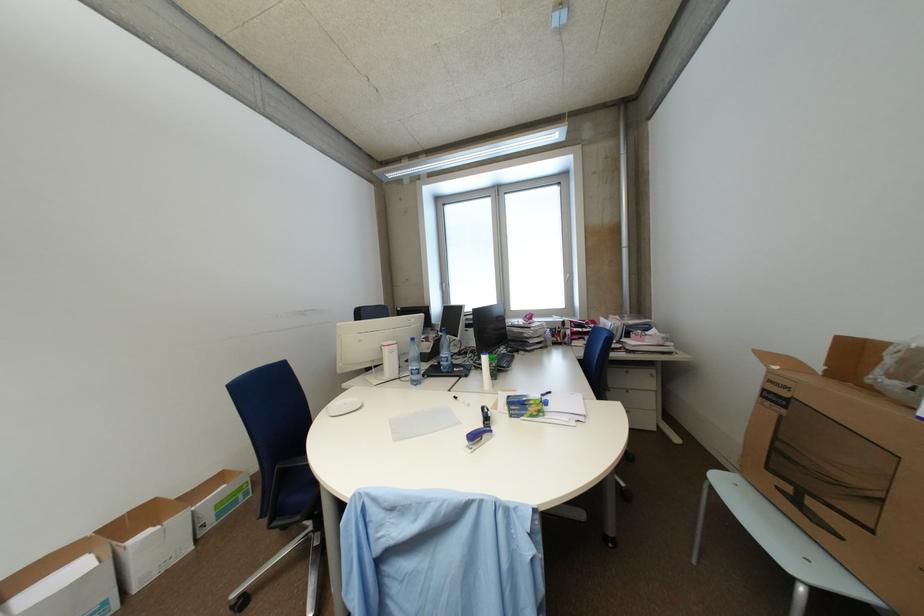
Identify the location of blue chair sitting surface. Image resolution: width=924 pixels, height=616 pixels. pos(292,464).